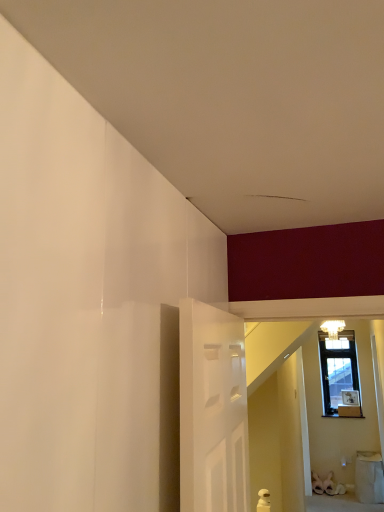
Question: Is matte white chandelier at upper center bigger than white fabric laundry basket at lower right?

Choices:
 (A) no
 (B) yes

Answer: (A)

Question: From the image's perspective, does matte white chandelier at upper center appear lower than white fabric laundry basket at lower right?

Choices:
 (A) no
 (B) yes

Answer: (A)

Question: Can you confirm if matte white chandelier at upper center is positioned to the right of white fabric laundry basket at lower right?

Choices:
 (A) no
 (B) yes

Answer: (A)

Question: Is matte white chandelier at upper center turned away from white fabric laundry basket at lower right?

Choices:
 (A) no
 (B) yes

Answer: (A)

Question: Is matte white chandelier at upper center oriented towards white fabric laundry basket at lower right?

Choices:
 (A) no
 (B) yes

Answer: (A)

Question: From a real-world perspective, is matte white chandelier at upper center on white fabric laundry basket at lower right?

Choices:
 (A) yes
 (B) no

Answer: (A)

Question: Considering the relative sizes of white fabric laundry basket at lower right and matte white chandelier at upper center in the image provided, is white fabric laundry basket at lower right shorter than matte white chandelier at upper center?

Choices:
 (A) no
 (B) yes

Answer: (A)

Question: Does white fabric laundry basket at lower right turn towards matte white chandelier at upper center?

Choices:
 (A) no
 (B) yes

Answer: (A)

Question: Is the surface of white fabric laundry basket at lower right in direct contact with matte white chandelier at upper center?

Choices:
 (A) no
 (B) yes

Answer: (A)

Question: Is white fabric laundry basket at lower right not near matte white chandelier at upper center?

Choices:
 (A) no
 (B) yes

Answer: (B)

Question: Considering the relative sizes of white fabric laundry basket at lower right and matte white chandelier at upper center in the image provided, is white fabric laundry basket at lower right thinner than matte white chandelier at upper center?

Choices:
 (A) yes
 (B) no

Answer: (B)

Question: Is white fabric laundry basket at lower right taller than matte white chandelier at upper center?

Choices:
 (A) yes
 (B) no

Answer: (A)

Question: Visually, is white fabric laundry basket at lower right positioned to the left or to the right of matte white chandelier at upper center?

Choices:
 (A) left
 (B) right

Answer: (B)